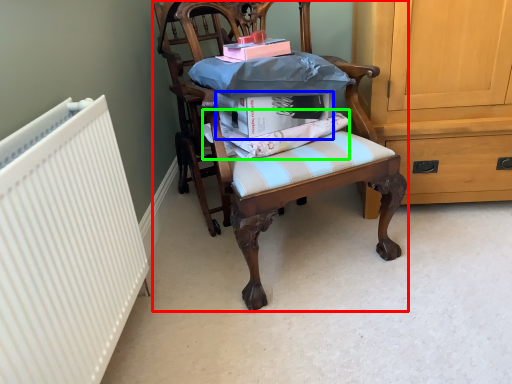
Question: Which is farther away from chair (highlighted by a red box)? book (highlighted by a blue box) or fabric (highlighted by a green box)?

Choices:
 (A) book
 (B) fabric

Answer: (A)